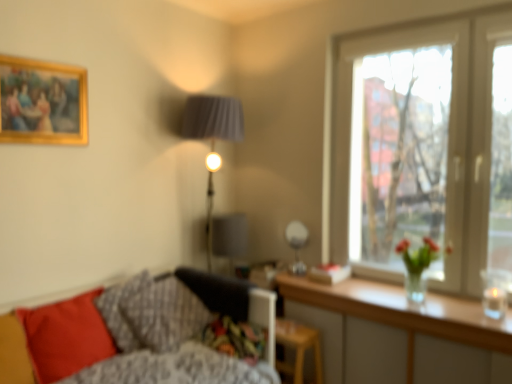
This screenshot has height=384, width=512. I want to click on free space above clear wood table at lower right (from a real-world perspective), so click(x=420, y=302).